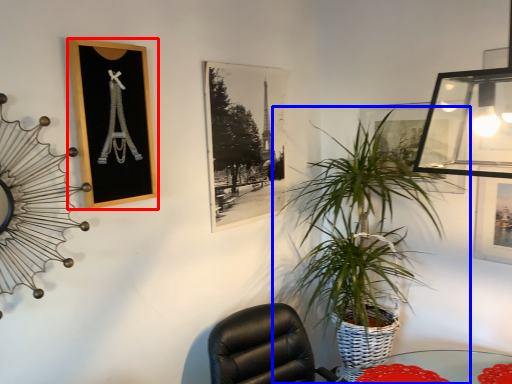
Question: Which object appears closest to the camera in this image, picture frame (highlighted by a red box) or houseplant (highlighted by a blue box)?

Choices:
 (A) picture frame
 (B) houseplant

Answer: (A)